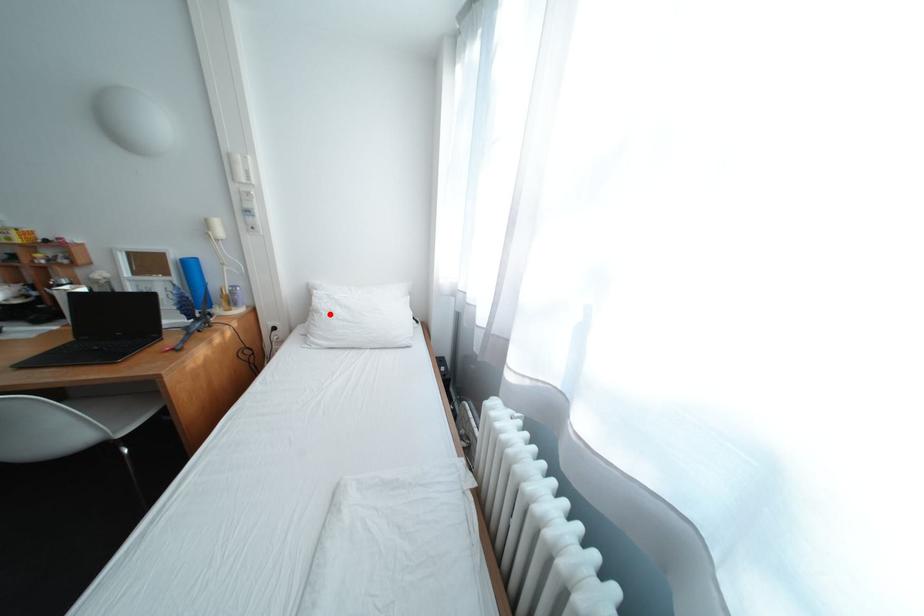
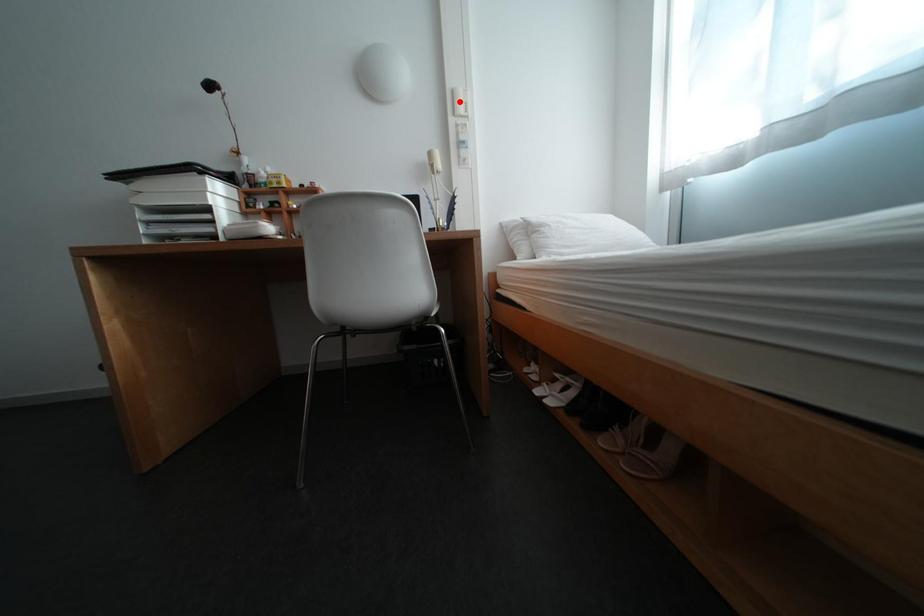
I am providing you with two images of the same scene from different viewpoints. A red point is marked on the first image and another point is marked on the second image. Are the points marked in image1 and image2 representing the same 3D position?

No